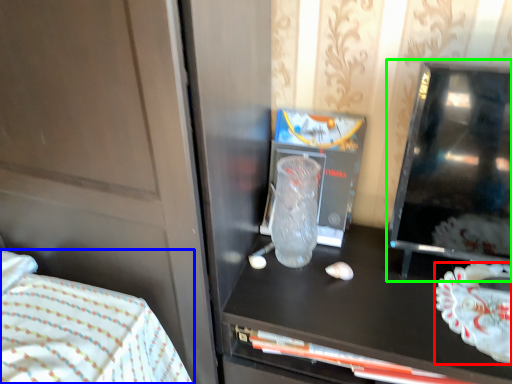
Question: Considering the real-world distances, which object is closest to food (highlighted by a red box)? bed (highlighted by a blue box) or appliance (highlighted by a green box).

Choices:
 (A) bed
 (B) appliance

Answer: (B)